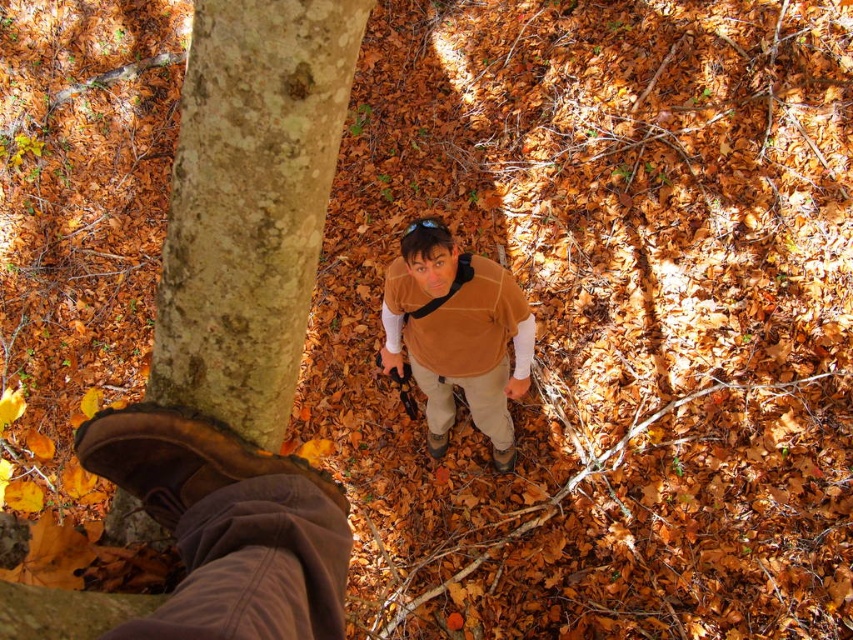
Between point (225, 260) and point (405, 273), which one is positioned behind?

The point (405, 273) is behind.

Does smooth bark tree trunk at center have a lesser width compared to brown suede vest at center?

Correct, smooth bark tree trunk at center's width is less than brown suede vest at center's.

Locate an element on the screen. smooth bark tree trunk at center is located at coordinates (250, 204).

At what (x,y) coordinates should I click in order to perform the action: click on smooth bark tree trunk at center. Please return your answer as a coordinate pair (x, y). The height and width of the screenshot is (640, 853). Looking at the image, I should click on 250,204.